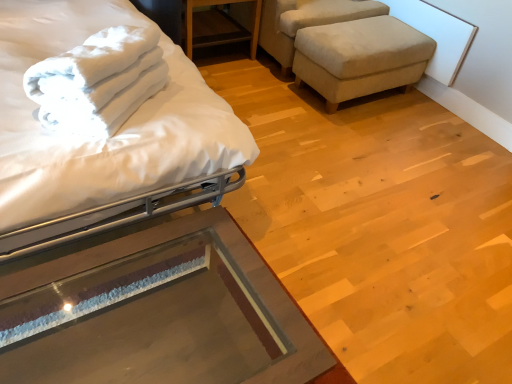
What is the approximate height of transparent glass table at lower left, acting as the first table starting from the bottom?

It is 15.75 inches.

This screenshot has height=384, width=512. Find the location of `wooden table at upper center, which is counted as the second table, starting from the front`. wooden table at upper center, which is counted as the second table, starting from the front is located at coordinates (218, 26).

Where is `white soft towel at upper left`? white soft towel at upper left is located at coordinates (98, 81).

Identify the location of transparent glass table at lower left, placed as the 2th table when sorted from top to bottom. Image resolution: width=512 pixels, height=384 pixels. (174, 312).

Is white soft towel at upper left positioned behind beige fabric swivel chair at upper right?

No, the depth of white soft towel at upper left is less than that of beige fabric swivel chair at upper right.

Would you consider white soft towel at upper left to be distant from beige fabric swivel chair at upper right?

white soft towel at upper left is positioned a significant distance from beige fabric swivel chair at upper right.

Is point (28, 70) in front of point (277, 21)?

Yes, it is.

From the picture: Is white soft towel at upper left facing towards beige fabric swivel chair at upper right?

No, white soft towel at upper left is not oriented towards beige fabric swivel chair at upper right.

From a real-world perspective, who is located higher, white matte bed at left or beige fabric swivel chair at upper right?

From a 3D spatial view, white matte bed at left is above.

From the image's perspective, is white matte bed at left positioned above or below beige fabric swivel chair at upper right?

From the image's perspective, white matte bed at left appears below beige fabric swivel chair at upper right.

Does white matte bed at left have a greater height compared to beige fabric swivel chair at upper right?

Indeed, white matte bed at left has a greater height compared to beige fabric swivel chair at upper right.

In the image, there is a white matte bed at left. At what (x,y) coordinates should I click in order to perform the action: click on table above it (from the image's perspective). Please return your answer as a coordinate pair (x, y). Looking at the image, I should click on (218, 26).

Would you say white matte bed at left is a long distance from wooden table at upper center, which is counted as the second table, starting from the front?

That's right, there is a large distance between white matte bed at left and wooden table at upper center, which is counted as the second table, starting from the front.

In terms of height, does white matte bed at left look taller or shorter compared to wooden table at upper center, acting as the second table starting from the bottom?

Considering their sizes, white matte bed at left has more height than wooden table at upper center, acting as the second table starting from the bottom.

What's the angular difference between white matte bed at left and wooden table at upper center, the first table in the back-to-front sequence,'s facing directions?

The facing directions of white matte bed at left and wooden table at upper center, the first table in the back-to-front sequence, are 1.03 degrees apart.

Is beige fabric swivel chair at upper right oriented away from transparent glass table at lower left, acting as the first table starting from the bottom?

Result: No, beige fabric swivel chair at upper right's orientation is not away from transparent glass table at lower left, acting as the first table starting from the bottom.

Can you confirm if beige fabric swivel chair at upper right is shorter than transparent glass table at lower left, acting as the first table starting from the bottom?

Incorrect, the height of beige fabric swivel chair at upper right does not fall short of that of transparent glass table at lower left, acting as the first table starting from the bottom.

Is point (289, 33) closer or farther from the camera than point (118, 353)?

Point (289, 33) appears to be farther away from the viewer than point (118, 353).

Could you measure the distance between beige fabric swivel chair at upper right and transparent glass table at lower left, acting as the first table starting from the bottom?

6.33 feet.

Is transparent glass table at lower left, placed as the 2th table when sorted from top to bottom, not near white soft towel at upper left?

Result: No.

Between transparent glass table at lower left, the 1th table positioned from the front, and white soft towel at upper left, which one has less height?

white soft towel at upper left is shorter.

Does transparent glass table at lower left, the 1th table positioned from the front, appear on the left side of white soft towel at upper left?

No, transparent glass table at lower left, the 1th table positioned from the front, is not to the left of white soft towel at upper left.

Can you confirm if transparent glass table at lower left, positioned as the second table in back-to-front order, is bigger than white soft towel at upper left?

Yes.

Looking at this image, is beige fabric stool at right bigger than transparent glass table at lower left, the 1th table positioned from the front?

No.

Considering the relative positions of beige fabric stool at right and transparent glass table at lower left, positioned as the second table in back-to-front order, in the image provided, is beige fabric stool at right to the left of transparent glass table at lower left, positioned as the second table in back-to-front order, from the viewer's perspective?

In fact, beige fabric stool at right is to the right of transparent glass table at lower left, positioned as the second table in back-to-front order.

Considering the sizes of objects beige fabric stool at right and transparent glass table at lower left, acting as the first table starting from the bottom, in the image provided, who is thinner, beige fabric stool at right or transparent glass table at lower left, acting as the first table starting from the bottom,?

Thinner between the two is beige fabric stool at right.

Which is behind, point (120, 51) or point (28, 5)?

The point (28, 5) is farther.

From the picture: From the image's perspective, is white soft towel at upper left below white matte bed at left?

Yes, from the image's perspective, white soft towel at upper left is below white matte bed at left.

Between white soft towel at upper left and white matte bed at left, which one appears on the right side from the viewer's perspective?

white soft towel at upper left.

Identify the location of bath towel in front of the beige fabric swivel chair at upper right. The height and width of the screenshot is (384, 512). (98, 81).

You are a GUI agent. You are given a task and a screenshot of the screen. Output one action in this format:
    pyautogui.click(x=<x>, y=<y>)
    Task: Click on the swivel chair above the white matte bed at left (from the image's perspective)
    Image resolution: width=512 pixels, height=384 pixels.
    Given the screenshot: What is the action you would take?
    pyautogui.click(x=306, y=22)

Looking at the image, which one is located further to white soft towel at upper left, transparent glass table at lower left, positioned as the second table in back-to-front order, or beige fabric swivel chair at upper right?

Among the two, beige fabric swivel chair at upper right is located further to white soft towel at upper left.

Based on their spatial positions, is beige fabric stool at right or wooden table at upper center, the first table in the back-to-front sequence, closer to white soft towel at upper left?

wooden table at upper center, the first table in the back-to-front sequence, is closer to white soft towel at upper left.

Looking at the image, which one is located closer to white soft towel at upper left, white matte bed at left or beige fabric swivel chair at upper right?

white matte bed at left.

Looking at the image, which one is located further to beige fabric stool at right, transparent glass table at lower left, the 1th table positioned from the front, or beige fabric swivel chair at upper right?

transparent glass table at lower left, the 1th table positioned from the front.

When comparing their distances from transparent glass table at lower left, acting as the first table starting from the bottom, does beige fabric swivel chair at upper right or wooden table at upper center, acting as the second table starting from the bottom, seem further?

wooden table at upper center, acting as the second table starting from the bottom, is positioned further to the anchor transparent glass table at lower left, acting as the first table starting from the bottom.

When comparing their distances from white matte bed at left, does beige fabric stool at right or wooden table at upper center, the first table in the back-to-front sequence, seem closer?

wooden table at upper center, the first table in the back-to-front sequence, lies closer to white matte bed at left than the other object.

From the image, which object appears to be nearer to transparent glass table at lower left, acting as the first table starting from the bottom, white matte bed at left or white soft towel at upper left?

white matte bed at left is positioned closer to the anchor transparent glass table at lower left, acting as the first table starting from the bottom.

Estimate the real-world distances between objects in this image. Which object is closer to wooden table at upper center, the first table in the top-to-bottom sequence, white soft towel at upper left or beige fabric stool at right?

beige fabric stool at right is positioned closer to the anchor wooden table at upper center, the first table in the top-to-bottom sequence.

Where is `table between white matte bed at left and beige fabric swivel chair at upper right from front to back`? The image size is (512, 384). table between white matte bed at left and beige fabric swivel chair at upper right from front to back is located at coordinates [x=218, y=26].

Locate an element on the screen. table between white soft towel at upper left and beige fabric swivel chair at upper right along the z-axis is located at coordinates (218, 26).

Where is `bath towel located between white matte bed at left and wooden table at upper center, the first table in the back-to-front sequence, in the depth direction`? The image size is (512, 384). bath towel located between white matte bed at left and wooden table at upper center, the first table in the back-to-front sequence, in the depth direction is located at coordinates (98, 81).

At what (x,y) coordinates should I click in order to perform the action: click on bath towel between white matte bed at left and beige fabric stool at right in the front-back direction. Please return your answer as a coordinate pair (x, y). Looking at the image, I should click on (98, 81).